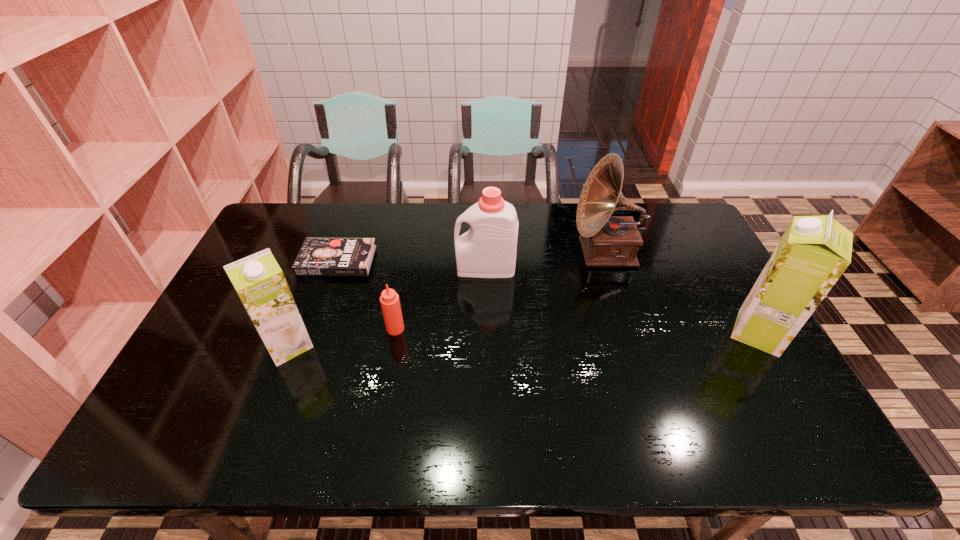
At what (x,y) coordinates should I click in order to perform the action: click on the left soya milk. Please return your answer as a coordinate pair (x, y). Looking at the image, I should click on (258, 280).

This screenshot has width=960, height=540. Find the location of `the right soya milk`. the right soya milk is located at coordinates (813, 253).

You are a GUI agent. You are given a task and a screenshot of the screen. Output one action in this format:
    pyautogui.click(x=<x>, y=<y>)
    Task: Click on the rightmost object
    The image size is (960, 540).
    Given the screenshot: What is the action you would take?
    pyautogui.click(x=813, y=253)

Where is `the shortest object`? the shortest object is located at coordinates (318, 256).

Where is `the third object from right to left`? The width and height of the screenshot is (960, 540). the third object from right to left is located at coordinates (488, 249).

Identify the location of phonograph record. This screenshot has height=540, width=960. (607, 241).

In order to click on the fifth tallest object in this screenshot , I will do `click(389, 299)`.

In order to click on the third object from left to right in this screenshot , I will do `click(389, 299)`.

At what (x,y) coordinates should I click in order to perform the action: click on vacant space situated 0.080m on the front of the left soya milk. Please return your answer as a coordinate pair (x, y). Looking at the image, I should click on (269, 394).

Find the location of a particular element. This screenshot has height=540, width=960. vacant region located 0.290m on the left of the right soya milk is located at coordinates (622, 333).